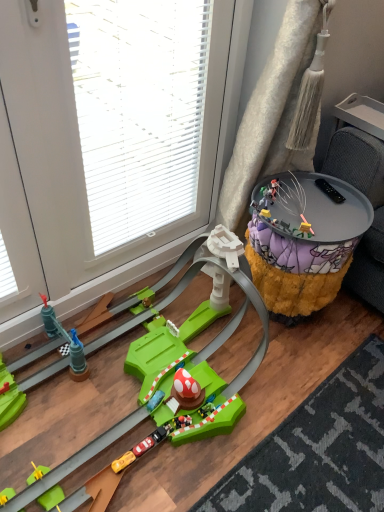
Question: From the image's perspective, would you say shaggy yellow ottoman at right is positioned over transparent plastic glass door at upper left?

Choices:
 (A) no
 (B) yes

Answer: (A)

Question: From a real-world perspective, is shaggy yellow ottoman at right positioned over transparent plastic glass door at upper left based on gravity?

Choices:
 (A) yes
 (B) no

Answer: (B)

Question: Is shaggy yellow ottoman at right at the right side of transparent plastic glass door at upper left?

Choices:
 (A) yes
 (B) no

Answer: (A)

Question: Is transparent plastic glass door at upper left at the back of shaggy yellow ottoman at right?

Choices:
 (A) no
 (B) yes

Answer: (B)

Question: Can you see shaggy yellow ottoman at right touching transparent plastic glass door at upper left?

Choices:
 (A) no
 (B) yes

Answer: (A)

Question: Is shaggy yellow ottoman at right taller than transparent plastic glass door at upper left?

Choices:
 (A) no
 (B) yes

Answer: (A)

Question: Can you confirm if transparent plastic glass door at upper left is positioned to the right of metallic gold figure at center-right, placed as the second toy when sorted from bottom to top?

Choices:
 (A) no
 (B) yes

Answer: (A)

Question: Does transparent plastic glass door at upper left have a greater height compared to metallic gold figure at center-right, arranged as the 1th toy when viewed from the right?

Choices:
 (A) yes
 (B) no

Answer: (A)

Question: Is transparent plastic glass door at upper left further to camera compared to metallic gold figure at center-right, arranged as the 1th toy when viewed from the right?

Choices:
 (A) yes
 (B) no

Answer: (B)

Question: From a real-world perspective, does transparent plastic glass door at upper left stand above metallic gold figure at center-right, acting as the 1th toy starting from the top?

Choices:
 (A) yes
 (B) no

Answer: (A)

Question: Is transparent plastic glass door at upper left shorter than metallic gold figure at center-right, the second toy positioned from the front?

Choices:
 (A) yes
 (B) no

Answer: (B)

Question: Is transparent plastic glass door at upper left positioned in front of metallic gold figure at center-right, acting as the 1th toy starting from the top?

Choices:
 (A) yes
 (B) no

Answer: (A)

Question: From the image's perspective, is green plastic race track at lower left, the first toy in the left-to-right sequence, beneath transparent plastic glass door at upper left?

Choices:
 (A) no
 (B) yes

Answer: (B)